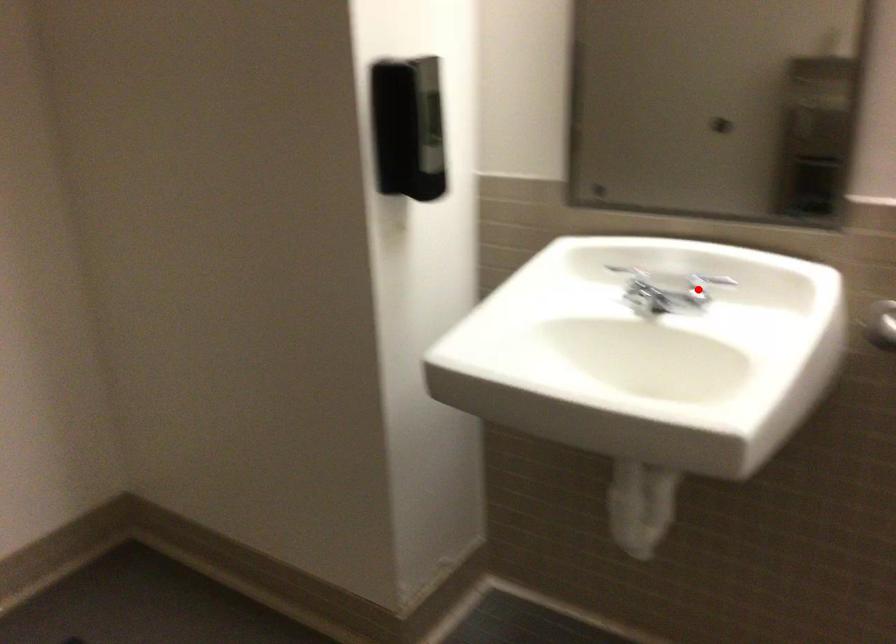
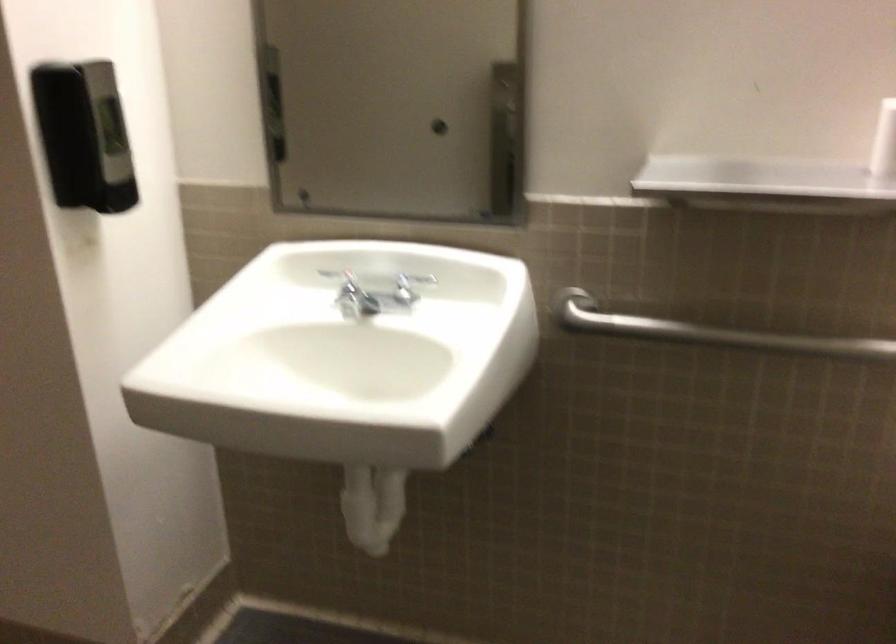
Locate, in the second image, the point that corresponds to the highlighted location in the first image.

(403, 290)